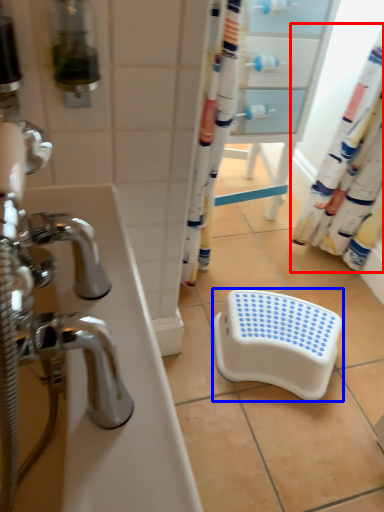
Question: Among these objects, which one is farthest to the camera, shower curtain (highlighted by a red box) or step stool (highlighted by a blue box)?

Choices:
 (A) shower curtain
 (B) step stool

Answer: (B)